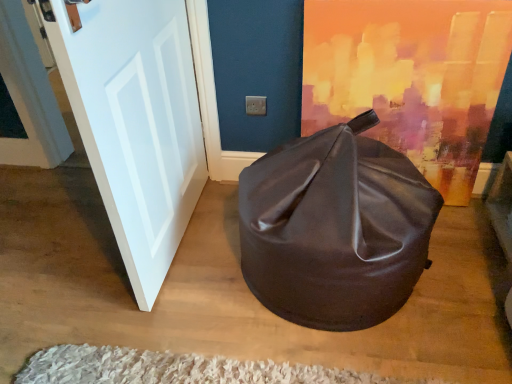
This screenshot has width=512, height=384. I want to click on free spot to the left of shiny brown bean bag at center, so tap(173, 279).